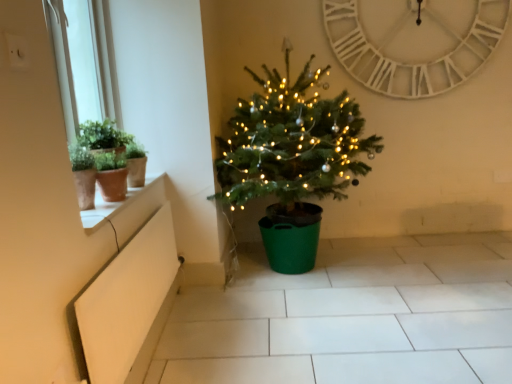
Question: Is green matte christmas tree at center in contact with white wooden clock at upper center?

Choices:
 (A) no
 (B) yes

Answer: (A)

Question: From the image's perspective, does green matte christmas tree at center appear higher than white wooden clock at upper center?

Choices:
 (A) yes
 (B) no

Answer: (B)

Question: Is green matte christmas tree at center oriented away from white wooden clock at upper center?

Choices:
 (A) yes
 (B) no

Answer: (B)

Question: Does green matte christmas tree at center lie behind white wooden clock at upper center?

Choices:
 (A) no
 (B) yes

Answer: (A)

Question: From the image's perspective, is green matte christmas tree at center below white wooden clock at upper center?

Choices:
 (A) no
 (B) yes

Answer: (B)

Question: From a real-world perspective, is green matte christmas tree at center beneath white wooden clock at upper center?

Choices:
 (A) no
 (B) yes

Answer: (B)

Question: Considering the relative positions of white matte window box at lower left and green matte christmas tree at center in the image provided, is white matte window box at lower left to the left of green matte christmas tree at center from the viewer's perspective?

Choices:
 (A) yes
 (B) no

Answer: (A)

Question: From a real-world perspective, is white matte window box at lower left positioned over green matte christmas tree at center based on gravity?

Choices:
 (A) no
 (B) yes

Answer: (A)

Question: From a real-world perspective, is white matte window box at lower left located beneath green matte christmas tree at center?

Choices:
 (A) no
 (B) yes

Answer: (B)

Question: Is white matte window box at lower left to the right of green matte christmas tree at center from the viewer's perspective?

Choices:
 (A) no
 (B) yes

Answer: (A)

Question: Is white matte window box at lower left not close to green matte christmas tree at center?

Choices:
 (A) no
 (B) yes

Answer: (A)

Question: Does white matte window box at lower left have a lesser height compared to green matte christmas tree at center?

Choices:
 (A) no
 (B) yes

Answer: (B)

Question: Considering the relative sizes of green matte christmas tree at center and white glossy window sill at upper left in the image provided, is green matte christmas tree at center thinner than white glossy window sill at upper left?

Choices:
 (A) no
 (B) yes

Answer: (A)